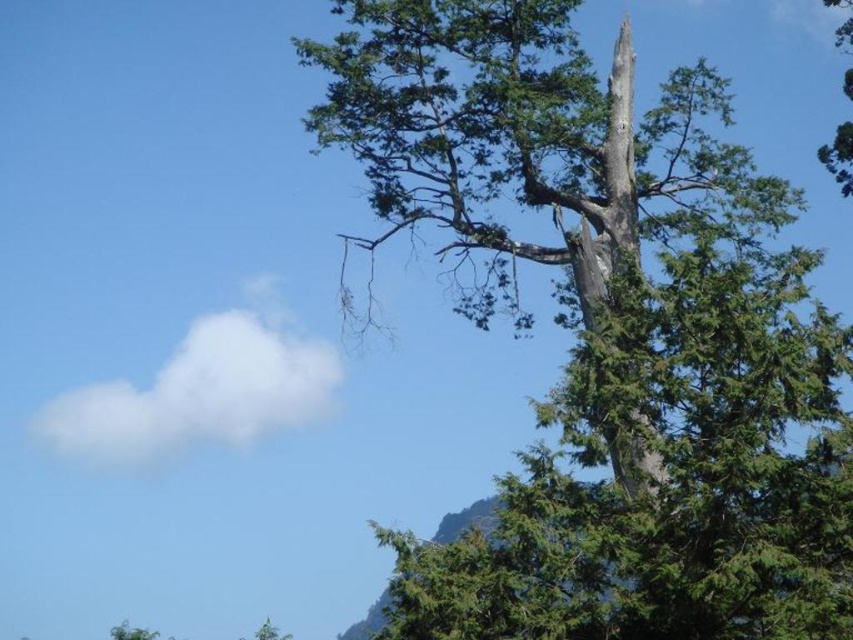
Is point (741, 577) farther from viewer compared to point (850, 72)?

No.

This screenshot has height=640, width=853. What do you see at coordinates (610, 332) in the screenshot?
I see `green rough bark tree at upper right` at bounding box center [610, 332].

Is point (682, 170) positioned before point (838, 168)?

Yes.

Locate an element on the screen. The width and height of the screenshot is (853, 640). green rough bark tree at upper right is located at coordinates (610, 332).

Consider the image. Can you confirm if gray bark tree trunk at upper right is positioned below green textured tree at upper right?

Indeed, gray bark tree trunk at upper right is positioned under green textured tree at upper right.

Which of these two, gray bark tree trunk at upper right or green textured tree at upper right, stands taller?

Standing taller between the two is gray bark tree trunk at upper right.

Between point (614, 64) and point (851, 96), which one is positioned in front?

Point (614, 64) is in front.

Where is `gray bark tree trunk at upper right`? The height and width of the screenshot is (640, 853). gray bark tree trunk at upper right is located at coordinates (608, 195).

Which is behind, point (683, 589) or point (584, 221)?

The point (584, 221) is behind.

What do you see at coordinates (610, 332) in the screenshot?
I see `green rough bark tree at upper right` at bounding box center [610, 332].

Describe the element at coordinates (610, 332) in the screenshot. I see `green rough bark tree at upper right` at that location.

What are the coordinates of `green rough bark tree at upper right` in the screenshot? It's located at (610, 332).